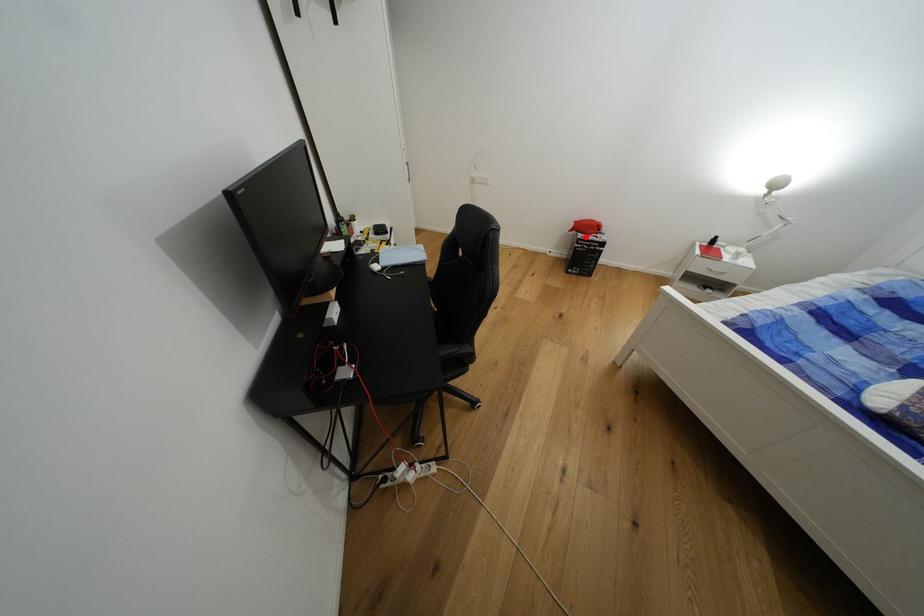
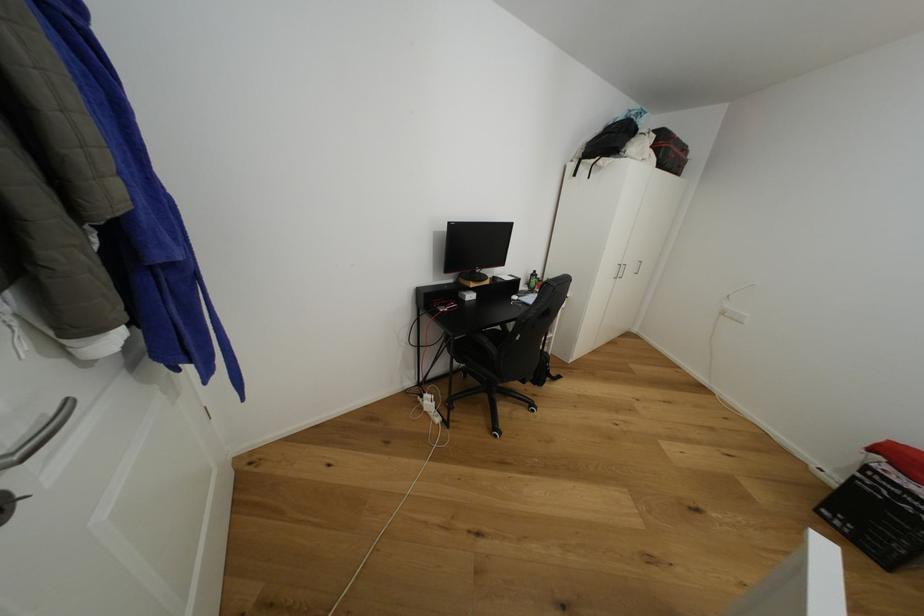
Question: I am providing you with two images of the same scene from different viewpoints. A red point is shown in image1. For the corresponding object point in image2, is it positioned nearer or farther from the camera?

Choices:
 (A) Nearer
 (B) Farther

Answer: (B)